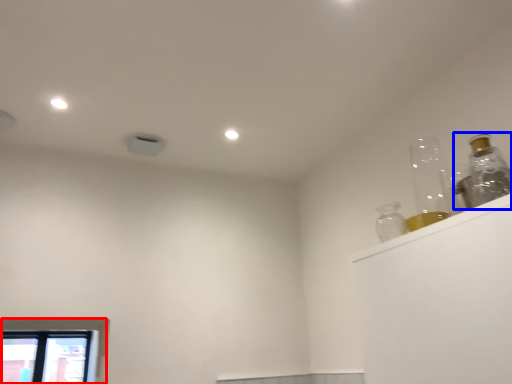
Question: Which of the following is the farthest to the observer, window (highlighted by a red box) or bottle (highlighted by a blue box)?

Choices:
 (A) window
 (B) bottle

Answer: (A)